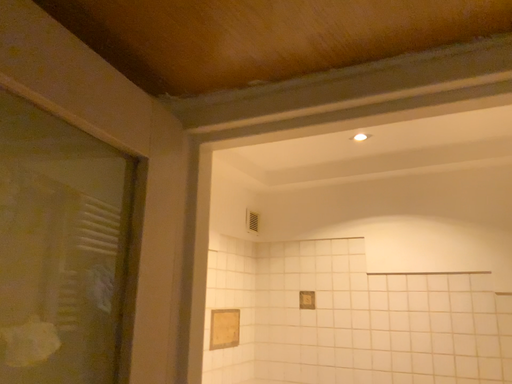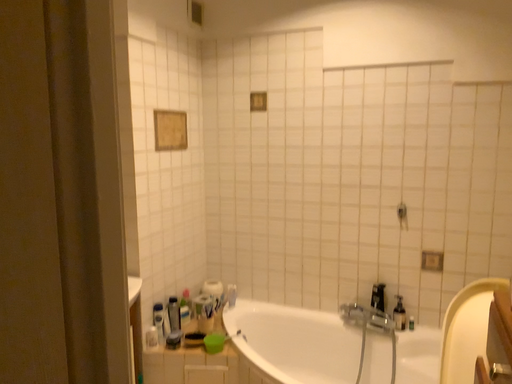
Question: Which way did the camera rotate in the video?

Choices:
 (A) rotated left
 (B) rotated right

Answer: (B)